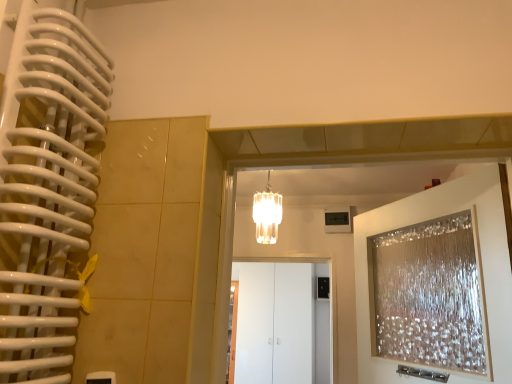
Question: Considering the positions of translucent glass chandelier at center and white glossy cabinet at center in the image, is translucent glass chandelier at center taller or shorter than white glossy cabinet at center?

Choices:
 (A) short
 (B) tall

Answer: (A)

Question: Choose the correct answer: Is translucent glass chandelier at center inside white glossy cabinet at center or outside it?

Choices:
 (A) outside
 (B) inside

Answer: (A)

Question: Considering the real-world distances, which object is closest to the white glossy cabinet at center?

Choices:
 (A) translucent glass chandelier at center
 (B) translucent glass door at upper right

Answer: (A)

Question: Which object is positioned farthest from the white glossy cabinet at center?

Choices:
 (A) translucent glass chandelier at center
 (B) translucent glass door at upper right

Answer: (B)